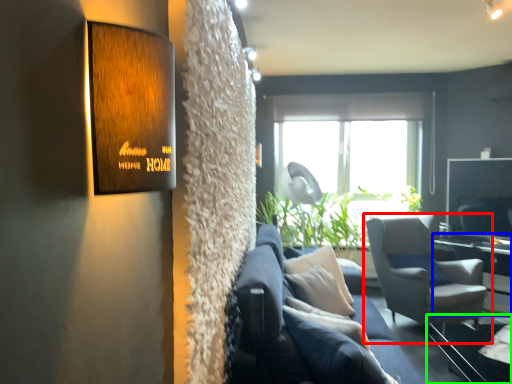
Question: Which object is positioned closest to chair (highlighted by a red box)? Select from table (highlighted by a blue box) and glass table (highlighted by a green box).

Choices:
 (A) table
 (B) glass table

Answer: (B)